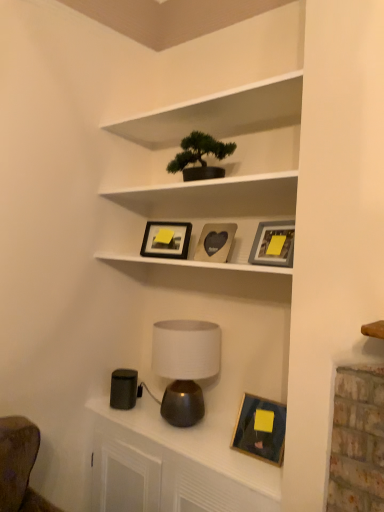
Question: Does point (192, 135) appear closer or farther from the camera than point (226, 464)?

Choices:
 (A) farther
 (B) closer

Answer: (A)

Question: Do you think green matte bonsai tree at upper center is within metallic lamp at lower center, or outside of it?

Choices:
 (A) inside
 (B) outside

Answer: (B)

Question: Which is farther from the matte brown table lamp at center?

Choices:
 (A) green matte bonsai tree at upper center
 (B) matte black picture frame at upper center, the first picture frame when ordered from top to bottom
 (C) matte gray picture frame at upper center, the second picture frame from the bottom
 (D) wooden picture frame at lower right, positioned as the 1th picture frame in bottom-to-top order
 (E) wooden heart-shaped photo frame at center, which is the third picture frame in bottom-to-top order

Answer: (A)

Question: Which object is the closest to the white matte shelf at upper center?

Choices:
 (A) green matte bonsai tree at upper center
 (B) matte brown table lamp at center
 (C) wooden heart-shaped photo frame at center, which is the second picture frame from top to bottom
 (D) matte black picture frame at upper center, acting as the 4th picture frame starting from the bottom
 (E) matte gray picture frame at upper center, the 3th picture frame when ordered from top to bottom

Answer: (A)